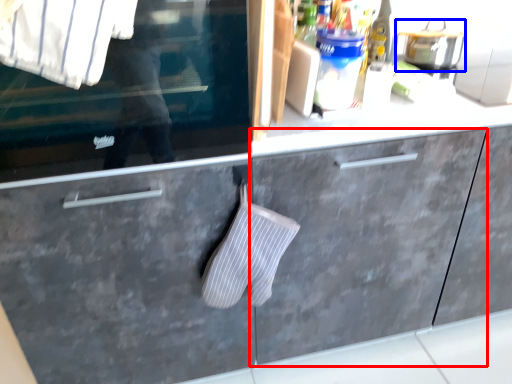
Question: Which object is closer to the camera taking this photo, cabinetry (highlighted by a red box) or appliance (highlighted by a blue box)?

Choices:
 (A) cabinetry
 (B) appliance

Answer: (A)